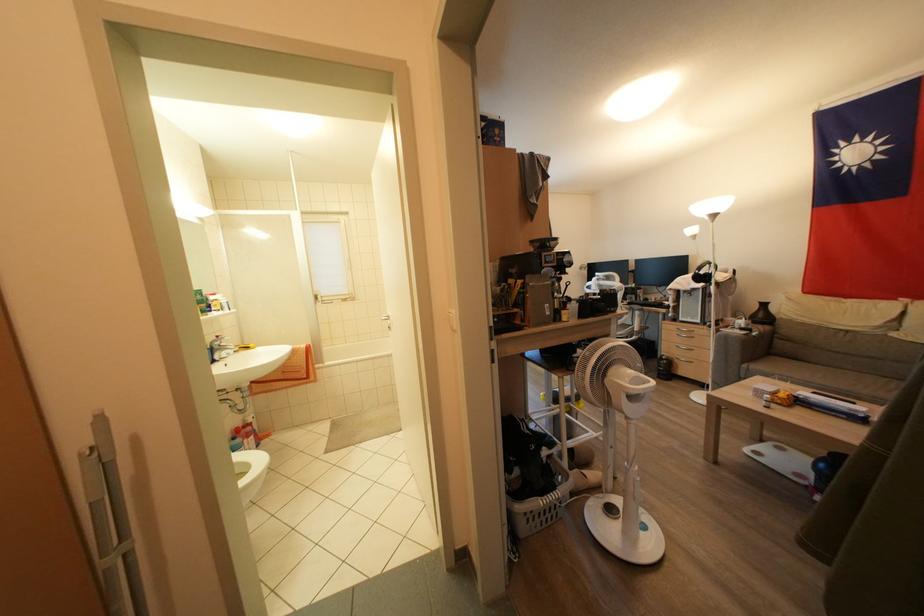
Where would you turn the coffee machine knob? Please return your answer as a coordinate pair (x, y).

(548, 297)